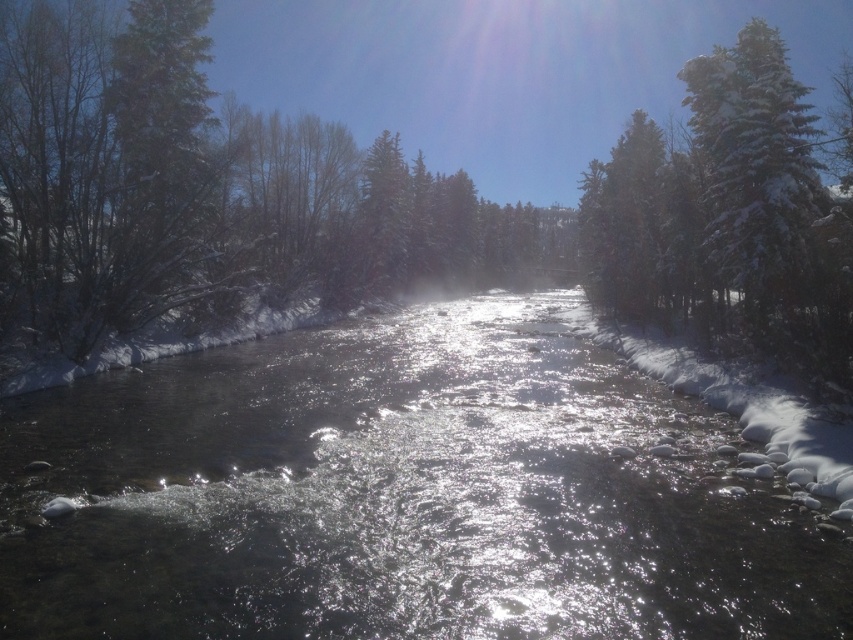
Question: Can you confirm if clear water at center is positioned to the right of snow-covered evergreen at upper right?

Choices:
 (A) no
 (B) yes

Answer: (A)

Question: Can you confirm if clear water at center is smaller than snow-covered evergreen at upper right?

Choices:
 (A) no
 (B) yes

Answer: (B)

Question: Which point is closer to the camera taking this photo?

Choices:
 (A) (813, 128)
 (B) (131, 554)

Answer: (B)

Question: Is clear water at center behind snow-covered evergreen at upper right?

Choices:
 (A) no
 (B) yes

Answer: (A)

Question: Among these points, which one is nearest to the camera?

Choices:
 (A) (83, 381)
 (B) (605, 260)

Answer: (A)